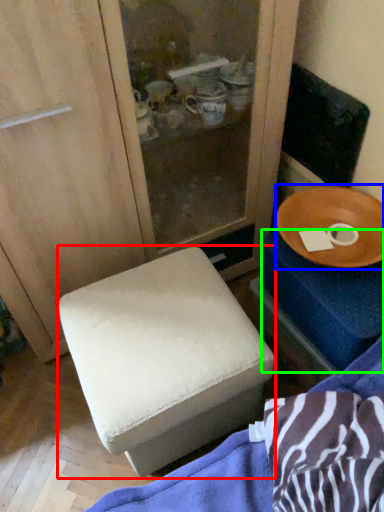
Question: Which is farther away from furniture (highlighted by a red box)? tableware (highlighted by a blue box) or changing table (highlighted by a green box)?

Choices:
 (A) tableware
 (B) changing table

Answer: (A)